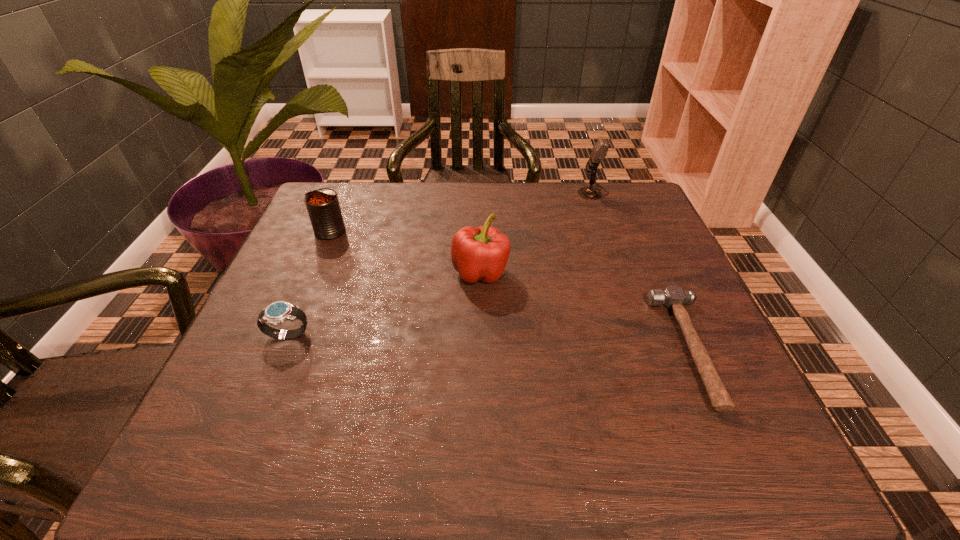
This screenshot has height=540, width=960. What are the coordinates of `free space located on the front of the can` in the screenshot? It's located at (306, 287).

The width and height of the screenshot is (960, 540). Identify the location of blank area located on the front of the third object from right to left. (480, 471).

You are a GUI agent. You are given a task and a screenshot of the screen. Output one action in this format:
    pyautogui.click(x=<x>, y=<y>)
    Task: Click on the blank area located 0.280m on the right of the watch
    
    Given the screenshot: What is the action you would take?
    pyautogui.click(x=453, y=336)

The image size is (960, 540). In order to click on vacant area located on the striking face of the shortest object in this screenshot , I will do `click(582, 348)`.

Identify the location of vacant space located 0.310m on the striking face of the shortest object. The width and height of the screenshot is (960, 540). (503, 348).

Image resolution: width=960 pixels, height=540 pixels. Identify the location of vacant space located 0.120m on the striking face of the shortest object. (602, 348).

Where is `microphone present at the far edge`? Image resolution: width=960 pixels, height=540 pixels. microphone present at the far edge is located at coordinates (600, 149).

I want to click on can that is positioned at the far edge, so click(x=323, y=207).

Identify the location of can present at the left edge. The width and height of the screenshot is (960, 540). (323, 207).

The height and width of the screenshot is (540, 960). Identify the location of watch positioned at the left edge. (278, 312).